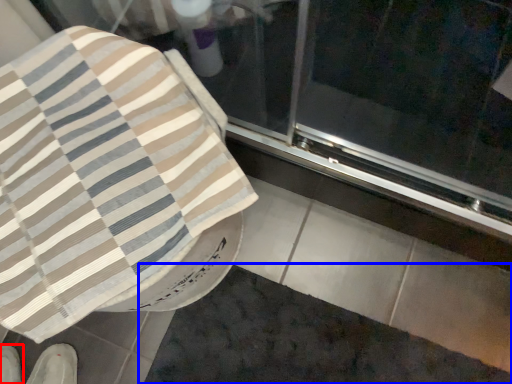
Question: Which object is further to the camera taking this photo, footwear (highlighted by a red box) or bath mat (highlighted by a blue box)?

Choices:
 (A) footwear
 (B) bath mat

Answer: (A)